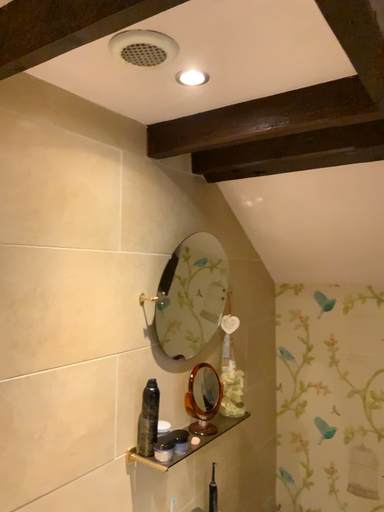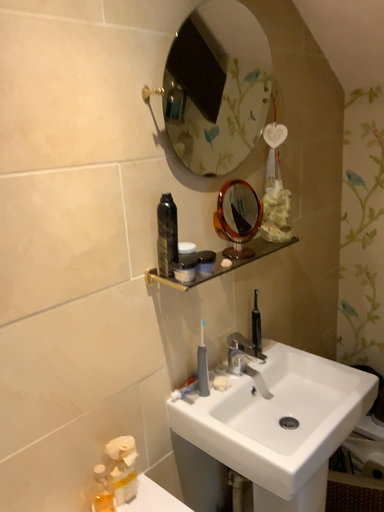
Question: Which way did the camera rotate in the video?

Choices:
 (A) rotated downward
 (B) rotated upward

Answer: (A)